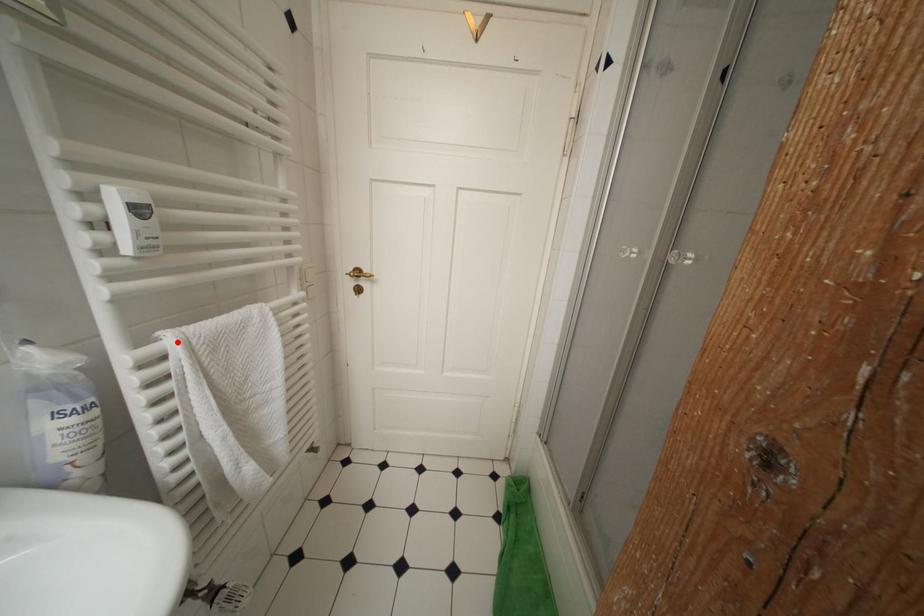
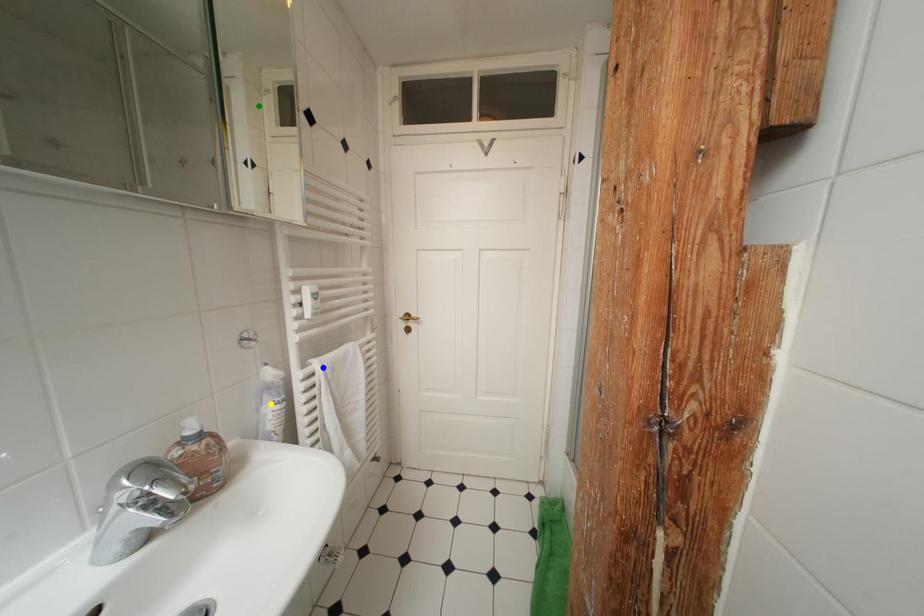
Question: I am providing you with two images of the same scene from different viewpoints. A red point is marked on the first image. You are given multiple points on the second image. Can you choose the point in image 2 that corresponds to the point in image 1?

Choices:
 (A) green point
 (B) blue point
 (C) yellow point

Answer: (B)